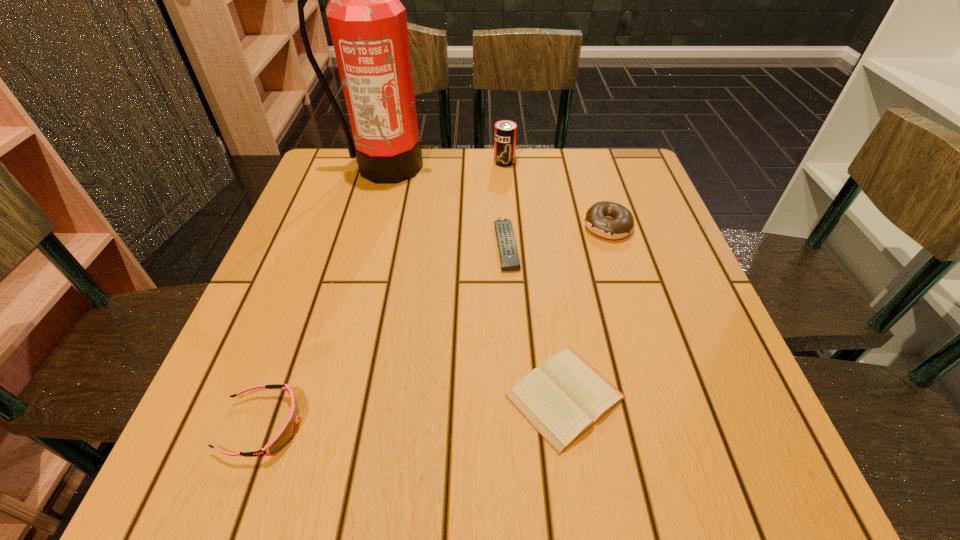
Locate an element on the screen. object positioned at the near left corner is located at coordinates (287, 432).

Identify the location of vacant space at the far edge. (432, 183).

Locate an element on the screen. blank area at the left edge is located at coordinates (338, 205).

Where is `vacant space at the right edge`? vacant space at the right edge is located at coordinates (728, 359).

The image size is (960, 540). In the image, there is a desktop. Find the location of `free space at the near left corner`. free space at the near left corner is located at coordinates (221, 454).

Locate an element on the screen. The height and width of the screenshot is (540, 960). vacant region at the far right corner is located at coordinates coord(641,183).

In the image, there is a desktop. Identify the location of vacant area at the near right corner. The width and height of the screenshot is (960, 540). (755, 476).

Locate an element on the screen. This screenshot has width=960, height=540. vacant area that lies between the goggles and the fire extinguisher is located at coordinates (324, 295).

The width and height of the screenshot is (960, 540). Find the location of `vacant point located between the goggles and the diary`. vacant point located between the goggles and the diary is located at coordinates (414, 411).

At what (x,y) coordinates should I click in order to perform the action: click on free space between the fifth shortest object and the tallest object. Please return your answer as a coordinate pair (x, y). This screenshot has width=960, height=540. Looking at the image, I should click on pyautogui.click(x=444, y=164).